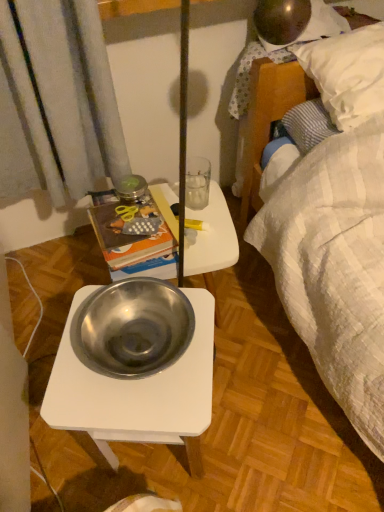
Find the location of a particular element. free space to the right of polished stainless steel bowl at center is located at coordinates (267, 421).